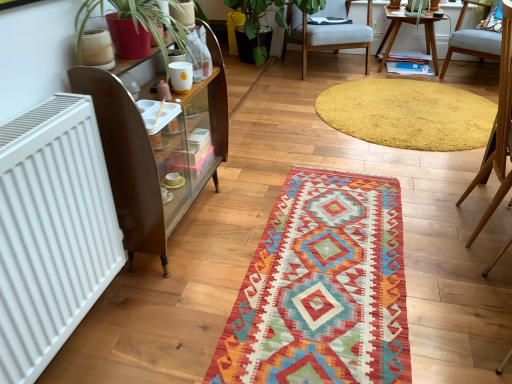
Locate an element on the screen. The height and width of the screenshot is (384, 512). vacant space in between light blue fabric chair at right, which is the 1th chair from front to back, and yellow shaggy rug at upper center, which appears as the 1th mat when viewed from the top is located at coordinates (408, 168).